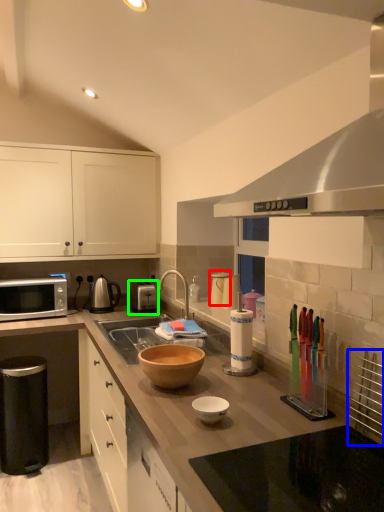
Question: Based on their relative distances, which object is farther from appliance (highlighted by a red box)? Choose from appliance (highlighted by a blue box) and appliance (highlighted by a green box).

Choices:
 (A) appliance
 (B) appliance

Answer: (A)